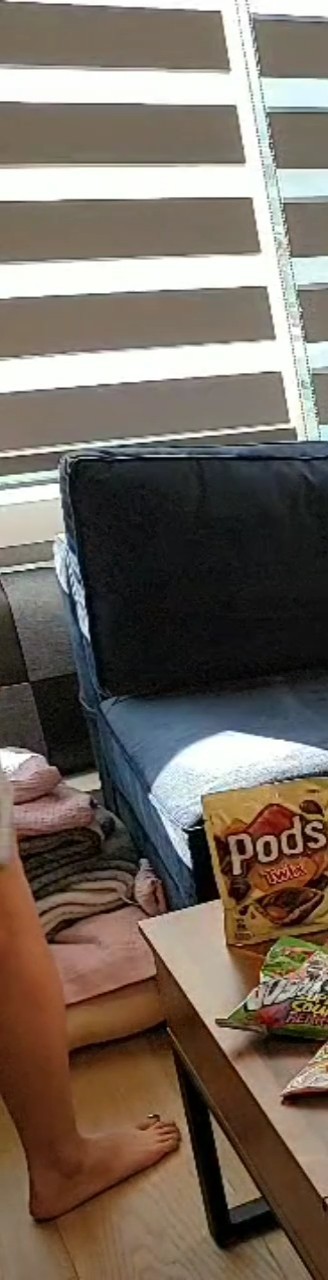
Identify the location of couch. (212, 500).